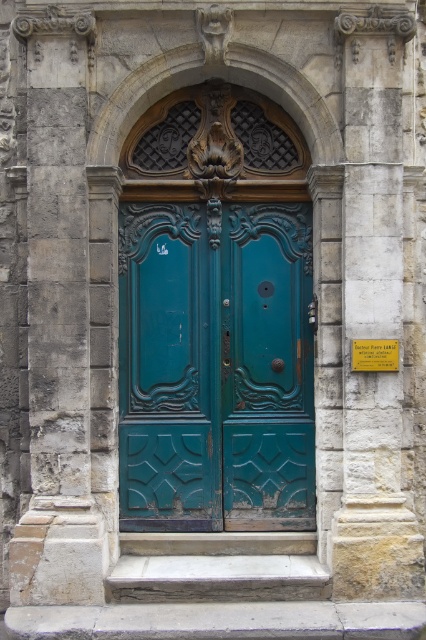
You are standing in front of an old building and see the teal carved wood door at center and the stone textured pillar at right. Which object is closer to your left side?

The teal carved wood door at center is closer to your left side since it is positioned to the left of the stone textured pillar at right.

You are standing in front of the teal door and want to touch both points on the door. Which point should you reach for first, point (279,449) or point (402,51)?

You should reach for point (279,449) first because it is closer to you than point (402,51), which is further away.

You are an architect assessing the symmetry of a building. You notice the teal carved wood door at center and the stone textured pillar at right. Which object is wider?

The teal carved wood door at center is wider than the stone textured pillar at right.